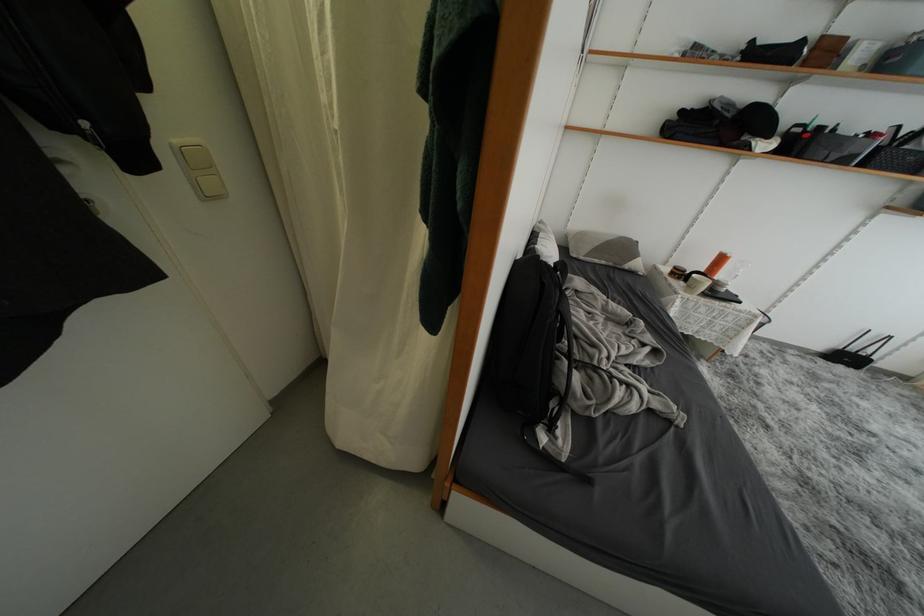
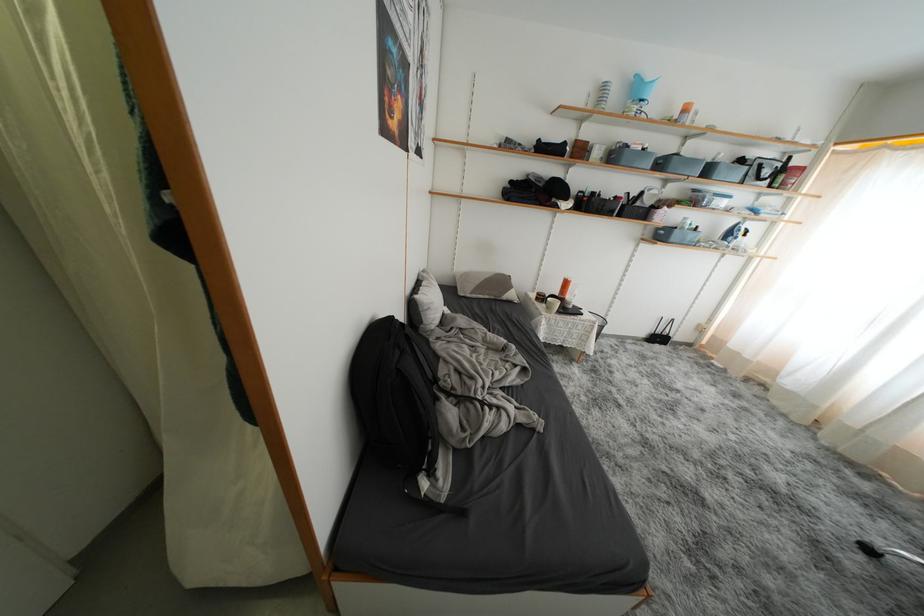
Where in the second image is the point corresponding to [883,50] from the first image?

(610, 152)